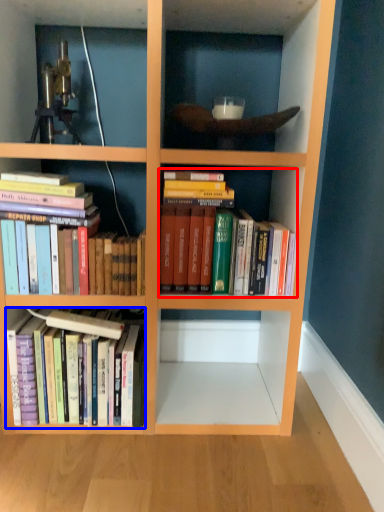
Question: Which point is further to the camera, book (highlighted by a red box) or book (highlighted by a blue box)?

Choices:
 (A) book
 (B) book

Answer: (B)